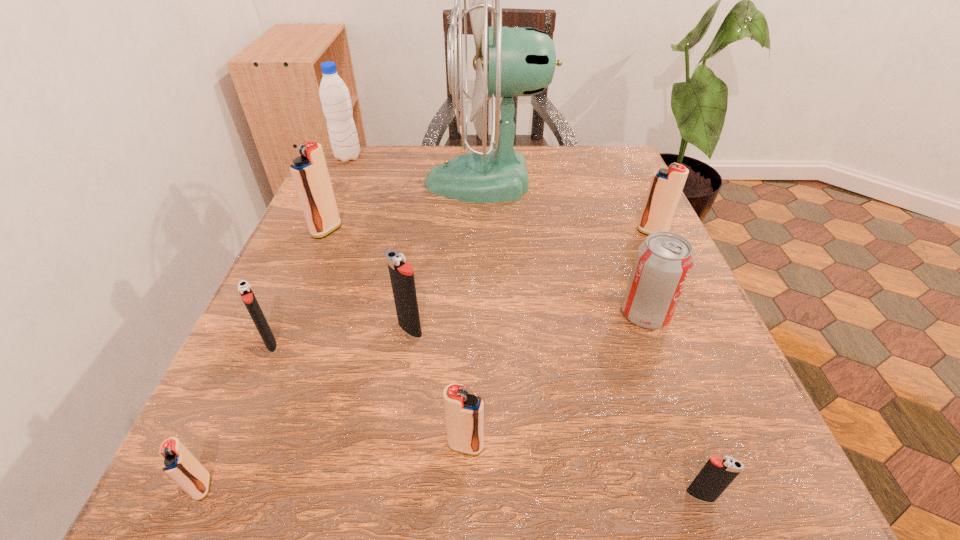
The width and height of the screenshot is (960, 540). Identify the location of water bottle that is at the far edge. (335, 99).

The height and width of the screenshot is (540, 960). I want to click on water bottle that is at the left edge, so click(x=335, y=99).

Where is `soda can positioned at the right edge`? The width and height of the screenshot is (960, 540). soda can positioned at the right edge is located at coordinates (663, 262).

Identify the location of object that is positioned at the far left corner. Image resolution: width=960 pixels, height=540 pixels. (335, 99).

Locate an element on the screen. The image size is (960, 540). object that is positioned at the near left corner is located at coordinates (179, 464).

Locate an element on the screen. The width and height of the screenshot is (960, 540). object located in the near right corner section of the desktop is located at coordinates (717, 474).

Identify the location of blank space at the far edge of the desktop. (554, 145).

In the image, there is a desktop. Identify the location of free space at the left edge. The width and height of the screenshot is (960, 540). (343, 373).

Locate an element on the screen. The height and width of the screenshot is (540, 960). vacant space at the right edge of the desktop is located at coordinates (608, 334).

Locate an element on the screen. This screenshot has height=540, width=960. vacant space at the far left corner is located at coordinates (386, 184).